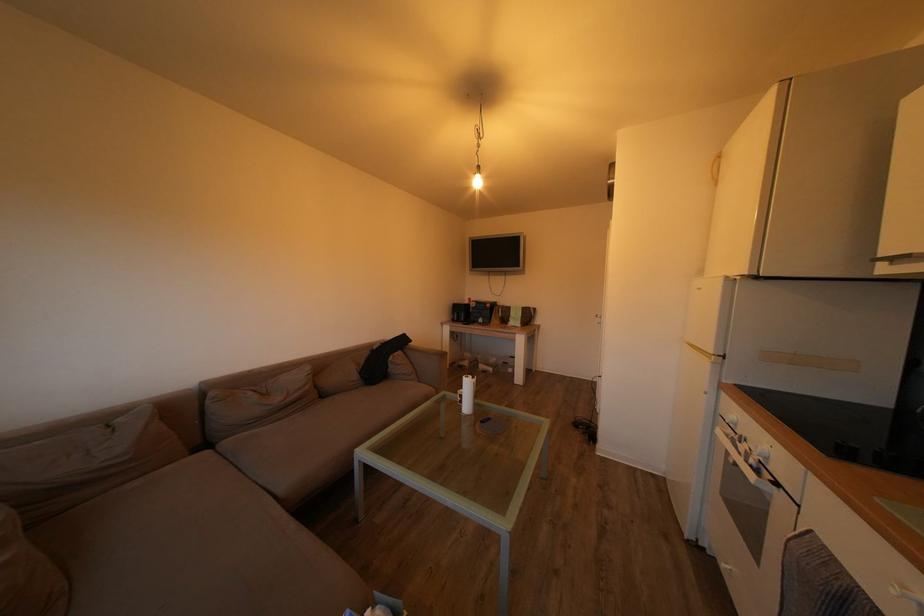
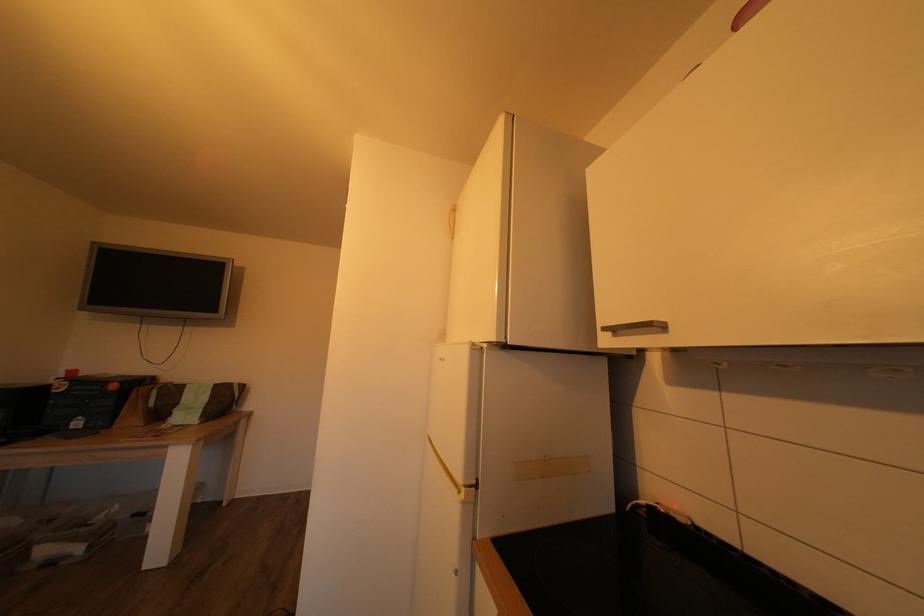
Where in the second image is the point corresponding to (719,358) from the first image?

(468, 487)